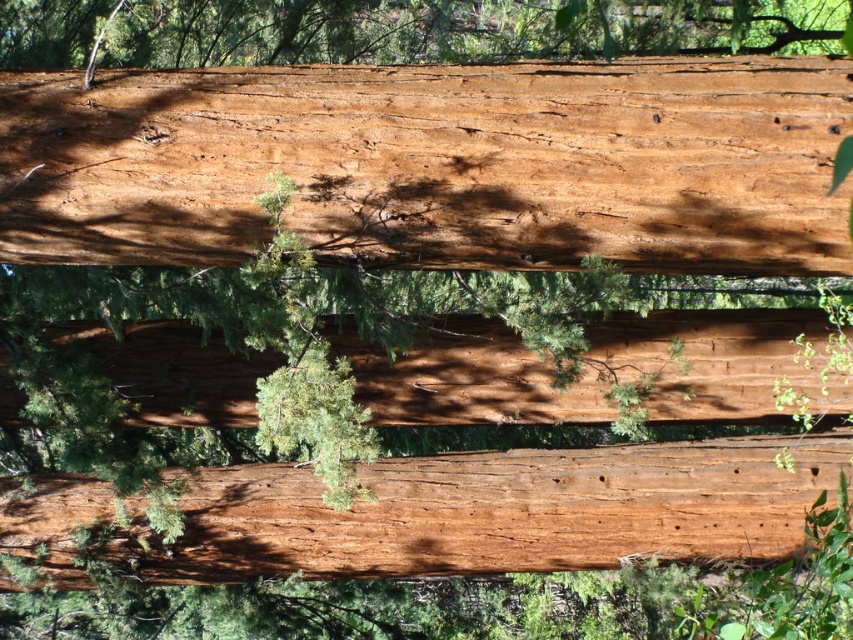
How far apart are smooth reddish-brown wood at center and smooth reddish-brown log at center?

The distance of smooth reddish-brown wood at center from smooth reddish-brown log at center is 1.62 meters.

Is smooth reddish-brown wood at center thinner than smooth reddish-brown log at center?

Correct, smooth reddish-brown wood at center's width is less than smooth reddish-brown log at center's.

Does point (100, 241) come farther from viewer compared to point (593, 451)?

No, (100, 241) is in front of (593, 451).

Locate an element on the screen. This screenshot has width=853, height=640. smooth reddish-brown wood at center is located at coordinates (436, 164).